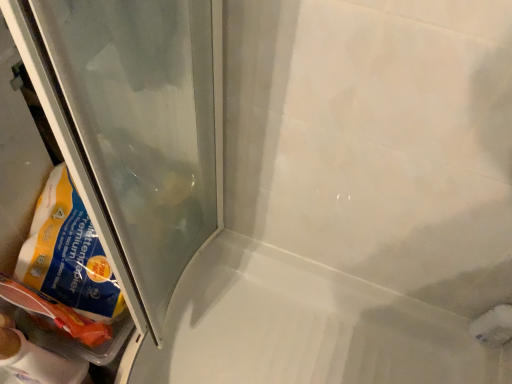
Question: Is white glossy bath at center wider or thinner than transparent plastic bag at lower left?

Choices:
 (A) thin
 (B) wide

Answer: (B)

Question: In the image, is white glossy bath at center positioned in front of or behind transparent plastic bag at lower left?

Choices:
 (A) front
 (B) behind

Answer: (B)

Question: From the image's perspective, is white glossy bath at center positioned above or below transparent plastic bag at lower left?

Choices:
 (A) above
 (B) below

Answer: (B)

Question: From the image's perspective, is transparent plastic bag at lower left located above or below white glossy bath at center?

Choices:
 (A) above
 (B) below

Answer: (A)

Question: In terms of width, does transparent plastic bag at lower left look wider or thinner when compared to white glossy bath at center?

Choices:
 (A) thin
 (B) wide

Answer: (A)

Question: Does point (163, 124) appear closer or farther from the camera than point (371, 339)?

Choices:
 (A) closer
 (B) farther

Answer: (A)

Question: Based on their positions, is transparent plastic bag at lower left located to the left or right of white glossy bath at center?

Choices:
 (A) left
 (B) right

Answer: (A)